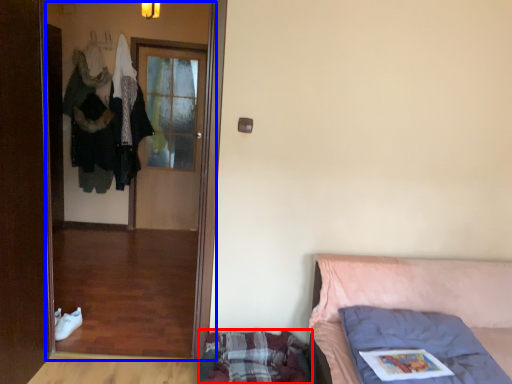
Question: Which of the following is the farthest to the observer, mattress (highlighted by a red box) or screen door (highlighted by a blue box)?

Choices:
 (A) mattress
 (B) screen door

Answer: (B)